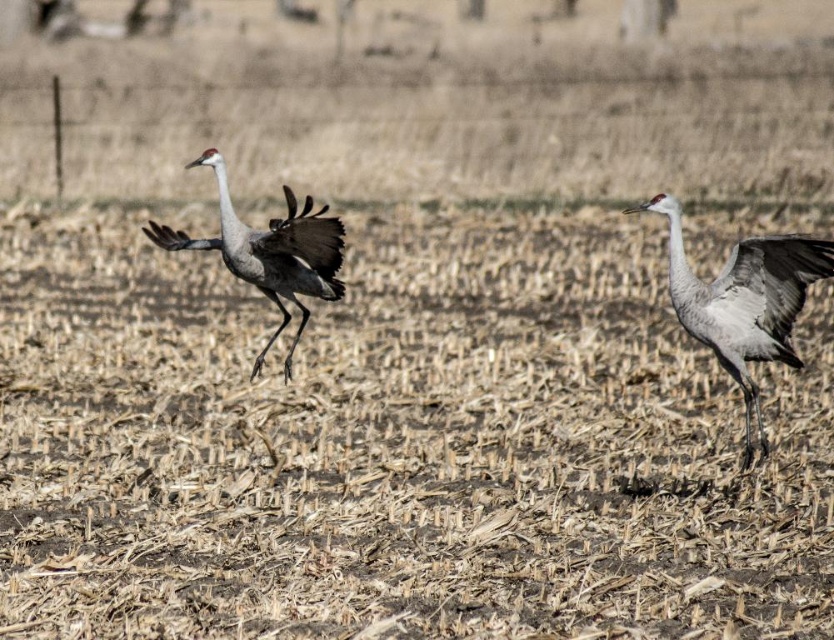
Between gray feathered crane at right and gray feathered crane at center, which one appears on the left side from the viewer's perspective?

From the viewer's perspective, gray feathered crane at center appears more on the left side.

Does gray feathered crane at right have a lesser width compared to gray feathered crane at center?

Yes, gray feathered crane at right is thinner than gray feathered crane at center.

Is point (770, 291) more distant than point (169, 234)?

No, (770, 291) is closer to viewer.

Image resolution: width=834 pixels, height=640 pixels. What are the coordinates of `gray feathered crane at right` in the screenshot? It's located at (744, 301).